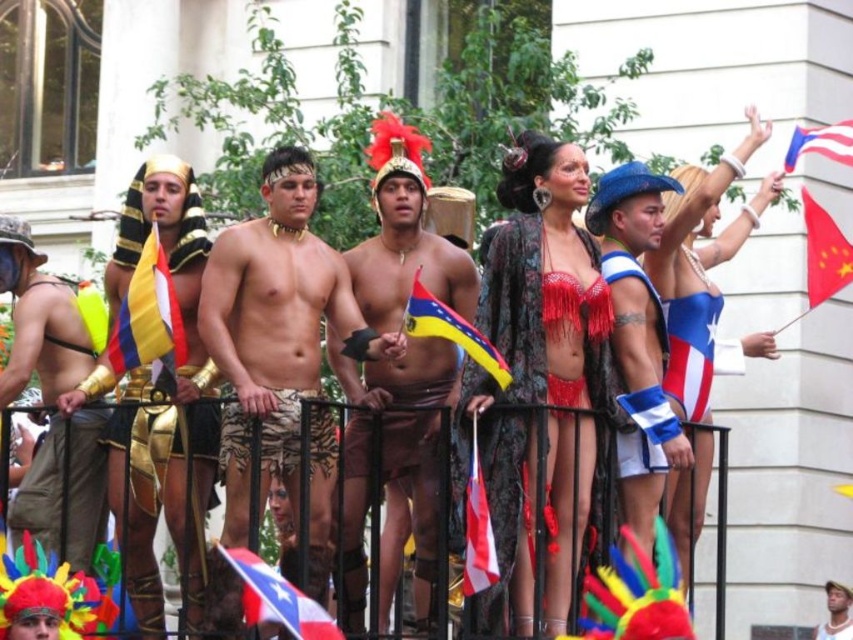
Question: Can you confirm if blue spandex shorts at center is thinner than yellow fabric flag at center?

Choices:
 (A) yes
 (B) no

Answer: (B)

Question: Estimate the real-world distances between objects in this image. Which object is farther from the blue and white fabric flag at center?

Choices:
 (A) camouflage shorts at center
 (B) white fabric with blue and red stripes at center
 (C) fringed velvet bikini at center
 (D) yellow and blue fabric flag at left

Answer: (D)

Question: Which object is positioned farthest from the matte gold armor at left?

Choices:
 (A) red fabric flag at center
 (B) blue spandex shorts at center
 (C) white matte hat at upper center

Answer: (C)

Question: Can you confirm if brown leather shorts at center is bigger than black metal railing at center?

Choices:
 (A) no
 (B) yes

Answer: (A)

Question: From the image, what is the correct spatial relationship of matte gold armor at left in relation to gold metallic armor at left?

Choices:
 (A) left
 (B) right

Answer: (A)

Question: Estimate the real-world distances between objects in this image. Which object is closer to the black metal railing at center?

Choices:
 (A) red fabric flag at upper right
 (B) yellow fabric flag at center
 (C) gold metallic armor at left

Answer: (C)